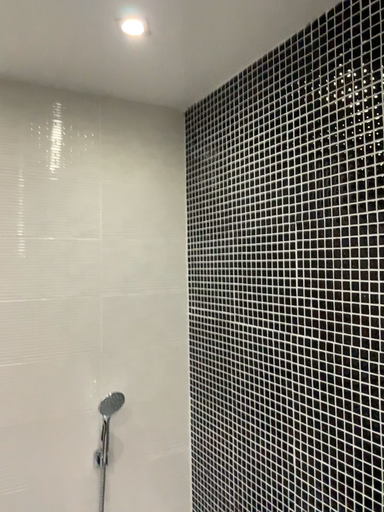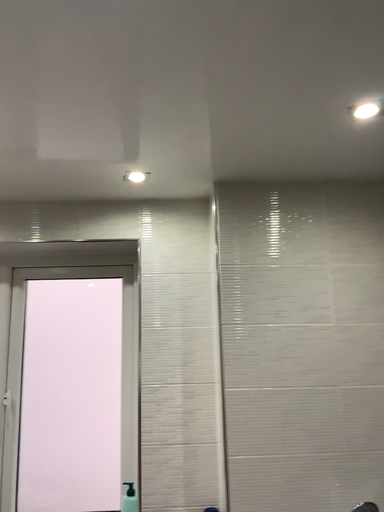
Question: How did the camera likely rotate when shooting the video?

Choices:
 (A) rotated downward
 (B) rotated upward

Answer: (B)